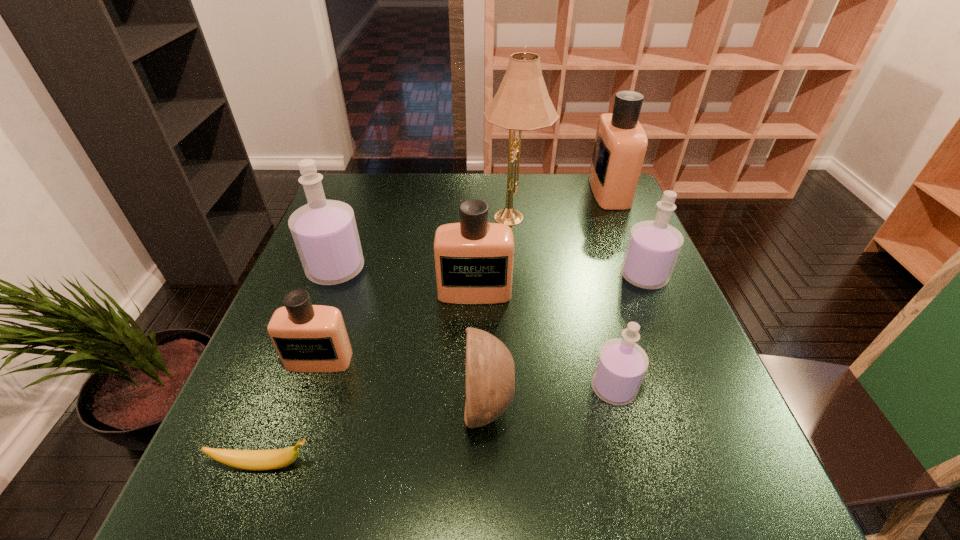
Identify the location of object present at the near left corner. Image resolution: width=960 pixels, height=540 pixels. (255, 460).

You are a GUI agent. You are given a task and a screenshot of the screen. Output one action in this format:
    pyautogui.click(x=<x>, y=<y>)
    Task: Click on the object located at the far right corner
    This screenshot has width=960, height=540.
    Given the screenshot: What is the action you would take?
    620,146

This screenshot has width=960, height=540. In the image, there is a desktop. Identify the location of vacant space at the far edge. (554, 198).

You are a GUI agent. You are given a task and a screenshot of the screen. Output one action in this format:
    pyautogui.click(x=<x>, y=<y>)
    Task: Click on the vacant space at the near edge of the desktop
    The height and width of the screenshot is (540, 960).
    Given the screenshot: What is the action you would take?
    tap(288, 526)

Where is `vacant space at the left edge of the desktop`? The width and height of the screenshot is (960, 540). vacant space at the left edge of the desktop is located at coordinates (272, 399).

In the image, there is a desktop. Identify the location of vacant space at the far left corner. The width and height of the screenshot is (960, 540). (345, 183).

At what (x,y) coordinates should I click in order to perform the action: click on free spot at the far right corner of the desktop. Please return your answer as a coordinate pair (x, y). Looking at the image, I should click on (578, 197).

Find the location of a particular element. The image size is (960, 540). free space at the near right corner is located at coordinates (682, 521).

Find the location of a particular element. This screenshot has height=540, width=960. vacant space that's between the bowl and the rightmost purple perfume is located at coordinates (565, 341).

I want to click on free space between the beige lampshade and the rightmost beige perfume, so click(x=562, y=204).